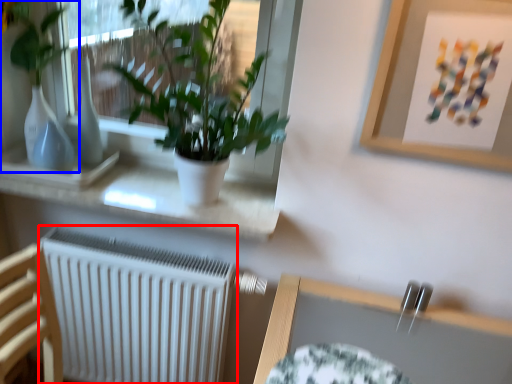
Question: Among these objects, which one is nearest to the camera, radiator (highlighted by a red box) or houseplant (highlighted by a blue box)?

Choices:
 (A) radiator
 (B) houseplant

Answer: (B)